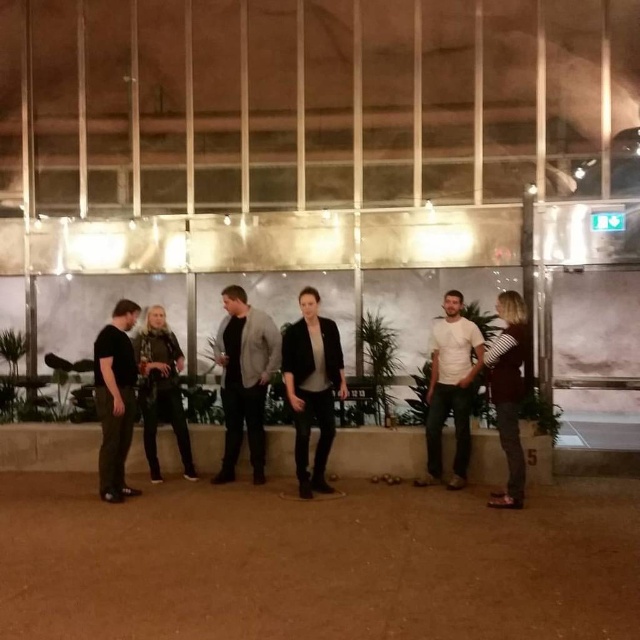
Which is above, white matte t-shirt at center or striped shirt at right?

white matte t-shirt at center is above.

Does white matte t-shirt at center have a lesser width compared to striped shirt at right?

No, white matte t-shirt at center is not thinner than striped shirt at right.

Is point (483, 339) positioned behind point (493, 339)?

Yes, point (483, 339) is farther from viewer.

The image size is (640, 640). What are the coordinates of `white matte t-shirt at center` in the screenshot? It's located at (451, 388).

How much distance is there between light gray textured blazer at center and white matte t-shirt at center?

1.72 meters

Is point (236, 360) in front of point (460, 296)?

No, it is not.

Image resolution: width=640 pixels, height=640 pixels. What do you see at coordinates (244, 378) in the screenshot?
I see `light gray textured blazer at center` at bounding box center [244, 378].

Where is `light gray textured blazer at center`? light gray textured blazer at center is located at coordinates (244, 378).

In the scene shown: Which is above, light gray textured blazer at center or camouflage-patterned shirt at center?

light gray textured blazer at center is higher up.

Is light gray textured blazer at center positioned at the back of camouflage-patterned shirt at center?

No, it is not.

Is point (253, 413) in front of point (177, 396)?

Yes, it is in front of point (177, 396).

You are a GUI agent. You are given a task and a screenshot of the screen. Output one action in this format:
    pyautogui.click(x=<x>, y=<y>)
    Task: Click on the light gray textured blazer at center
    The width and height of the screenshot is (640, 640).
    Given the screenshot: What is the action you would take?
    pyautogui.click(x=244, y=378)